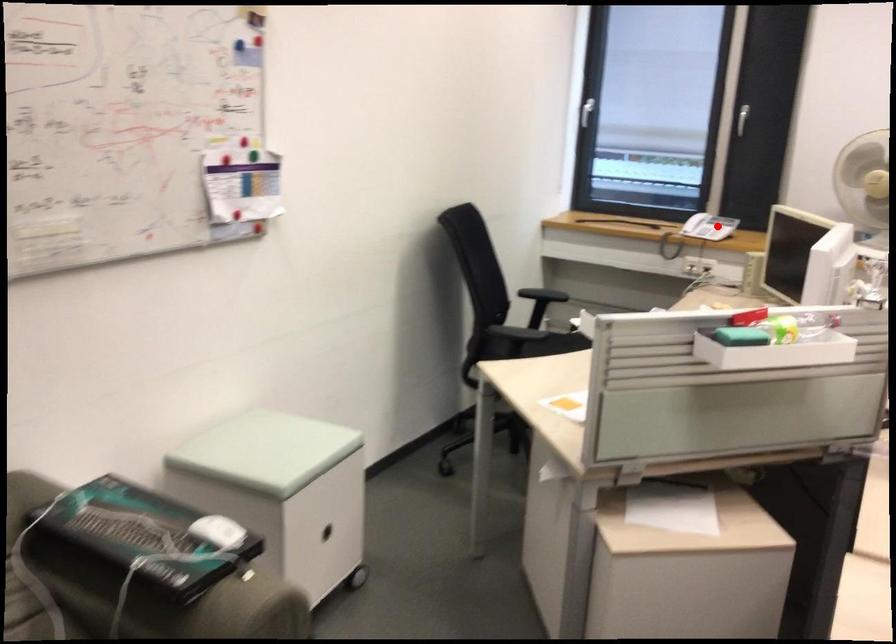
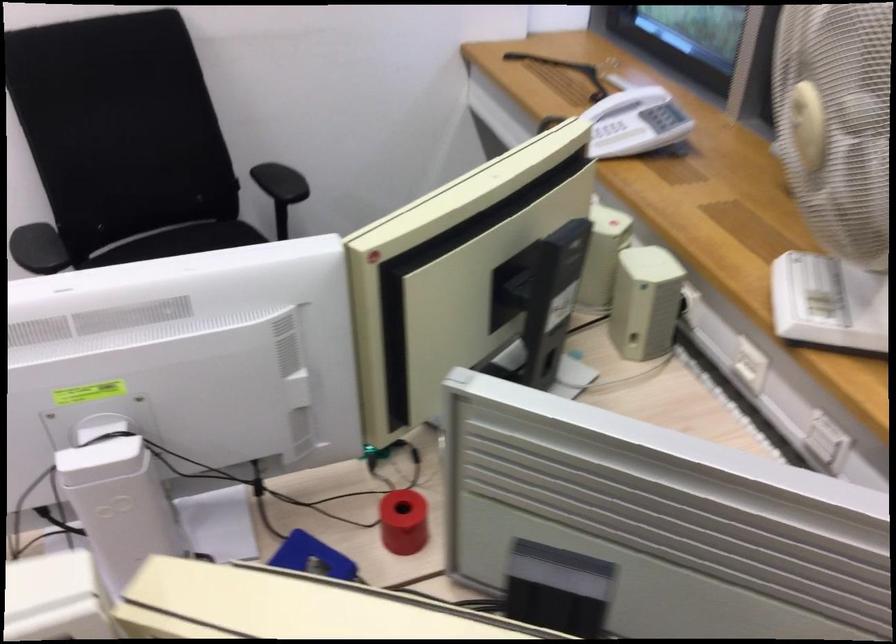
Question: I am providing you with two images of the same scene from different viewpoints. Image1 has a red point marked. In image2, the corresponding 3D location appears at what relative position? Reply with the corresponding letter.

Choices:
 (A) Closer
 (B) Farther

Answer: (A)